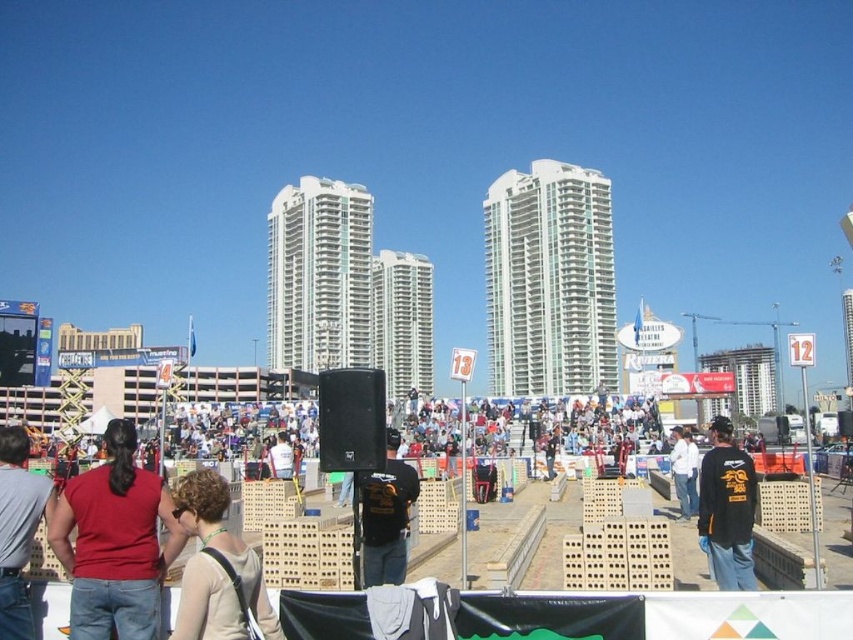
Does matte red shirt at left have a greater width compared to matte red shirt at lower left?

Yes, matte red shirt at left is wider than matte red shirt at lower left.

Does matte red shirt at left have a lesser height compared to matte red shirt at lower left?

No.

At what (x,y) coordinates should I click in order to perform the action: click on matte red shirt at left. Please return your answer as a coordinate pair (x, y). Looking at the image, I should click on (115, 541).

Where is `matte red shirt at left`? Image resolution: width=853 pixels, height=640 pixels. matte red shirt at left is located at coordinates (115, 541).

Does matte red shirt at left appear on the left side of black matte shirt at center?

Indeed, matte red shirt at left is positioned on the left side of black matte shirt at center.

Can you confirm if matte red shirt at left is wider than black matte shirt at center?

No, matte red shirt at left is not wider than black matte shirt at center.

Which is behind, point (131, 612) or point (711, 484)?

Positioned behind is point (711, 484).

Identify the location of matte red shirt at left. The height and width of the screenshot is (640, 853). coord(115,541).

Does light beige fabric at center appear on the right side of black t-shirt at center?

Incorrect, light beige fabric at center is not on the right side of black t-shirt at center.

In order to click on light beige fabric at center in this screenshot , I will do `click(218, 568)`.

Identify the location of light beige fabric at center. This screenshot has height=640, width=853. (218, 568).